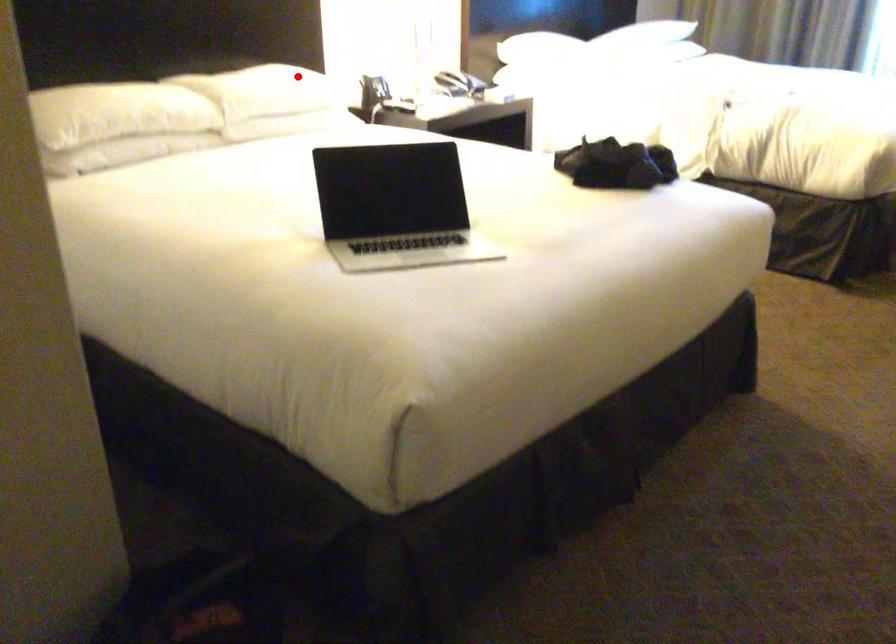
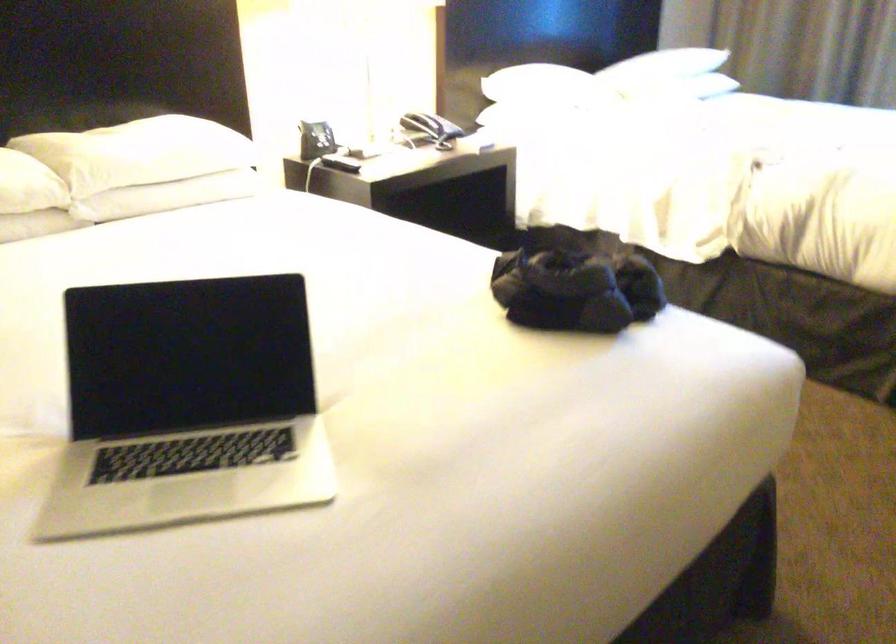
Find the pixel in the second image that matches the highlighted location in the first image.

(186, 136)